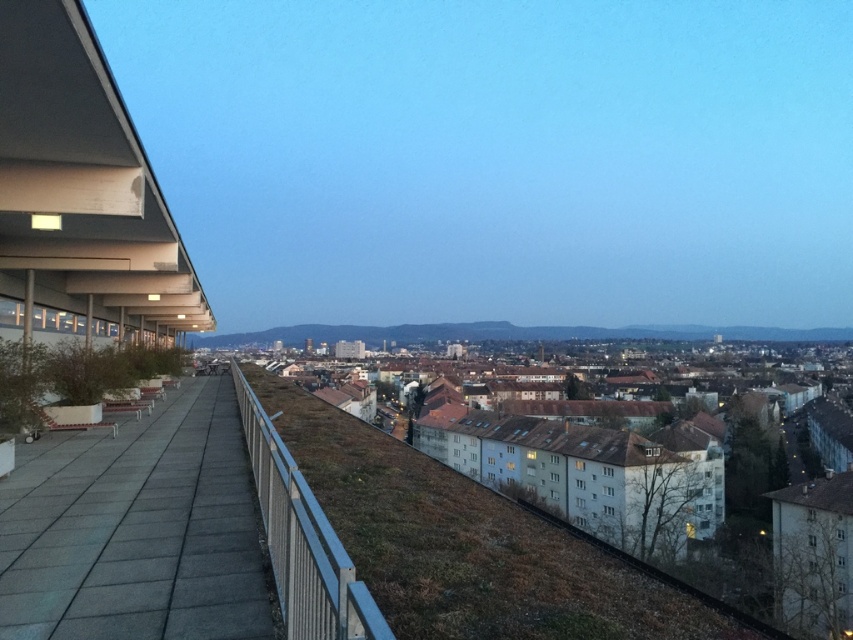
Question: Is green grass at center to the right of metallic silver rail at center from the viewer's perspective?

Choices:
 (A) no
 (B) yes

Answer: (B)

Question: Considering the relative positions of green grass at center and smooth concrete roof at left in the image provided, where is green grass at center located with respect to smooth concrete roof at left?

Choices:
 (A) left
 (B) right

Answer: (B)

Question: Which object is the farthest from the gray tile pavement at lower left?

Choices:
 (A) metallic silver rail at center
 (B) smooth concrete roof at left

Answer: (B)

Question: Estimate the real-world distances between objects in this image. Which object is closer to the metallic silver rail at center?

Choices:
 (A) gray tile pavement at lower left
 (B) smooth concrete roof at left
 (C) green grass at center

Answer: (C)

Question: Which object appears closest to the camera in this image?

Choices:
 (A) metallic silver rail at center
 (B) gray tile pavement at lower left
 (C) green grass at center
 (D) smooth concrete roof at left

Answer: (A)

Question: Is gray tile pavement at lower left below metallic silver rail at center?

Choices:
 (A) no
 (B) yes

Answer: (B)